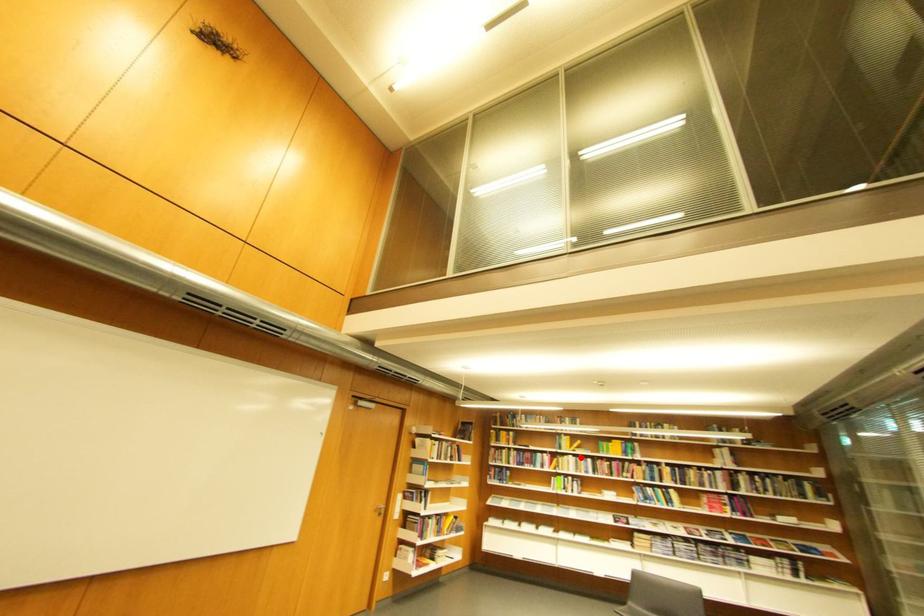
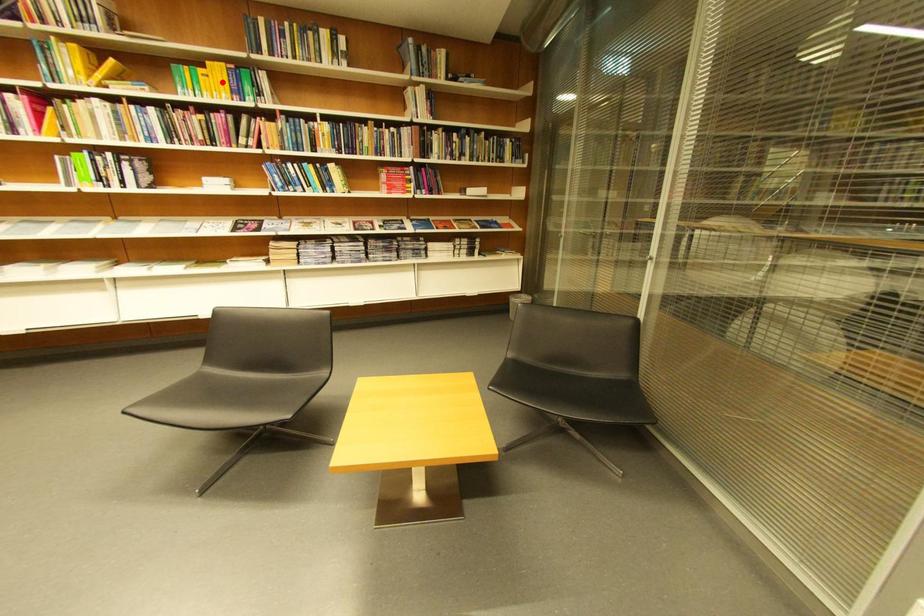
I am providing you with two images of the same scene from different viewpoints. A red point is marked on the first image and another point is marked on the second image. Is the marked point in image1 the same physical position as the marked point in image2?

No